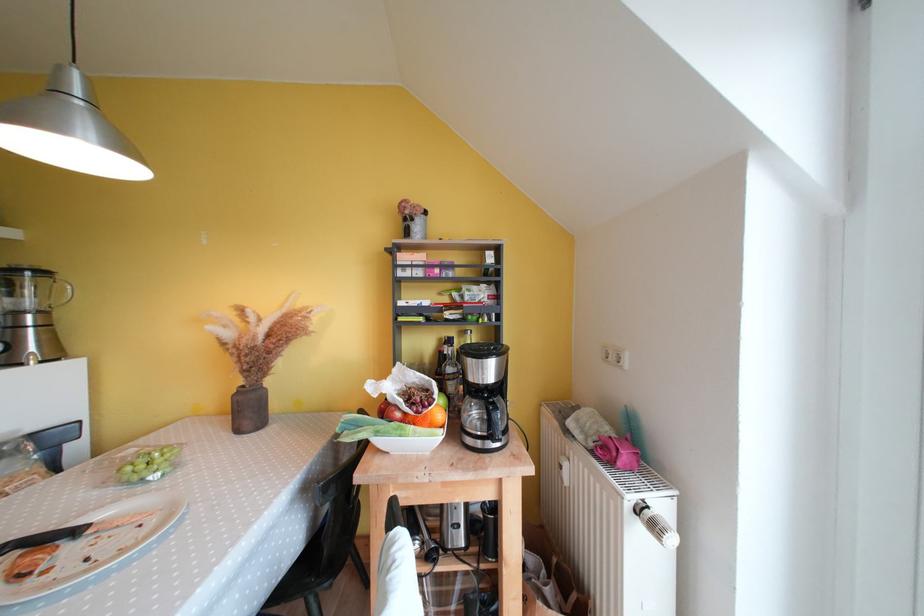
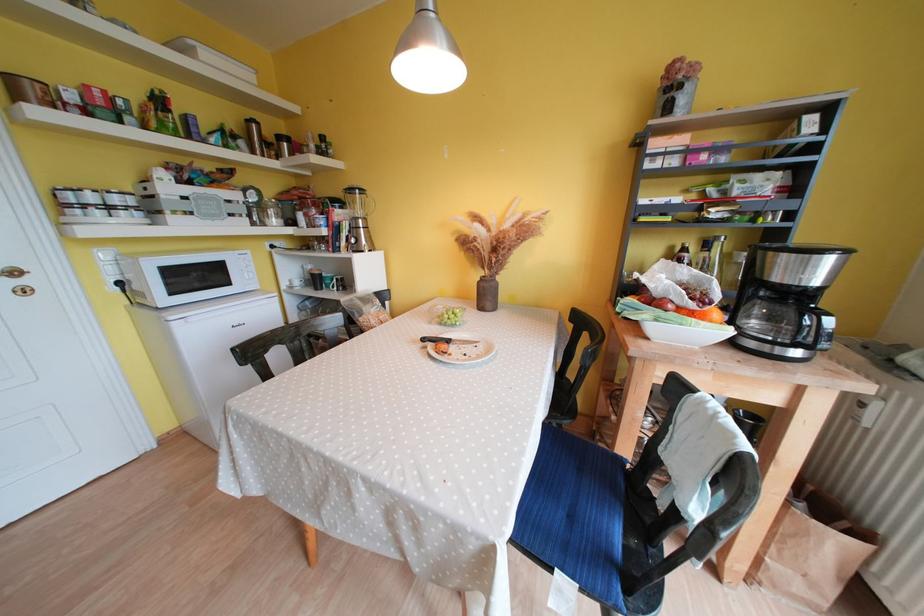
Looking at this image, the images are taken continuously from a first-person perspective. In which direction is your viewpoint rotating?

The camera rotated toward left-down.